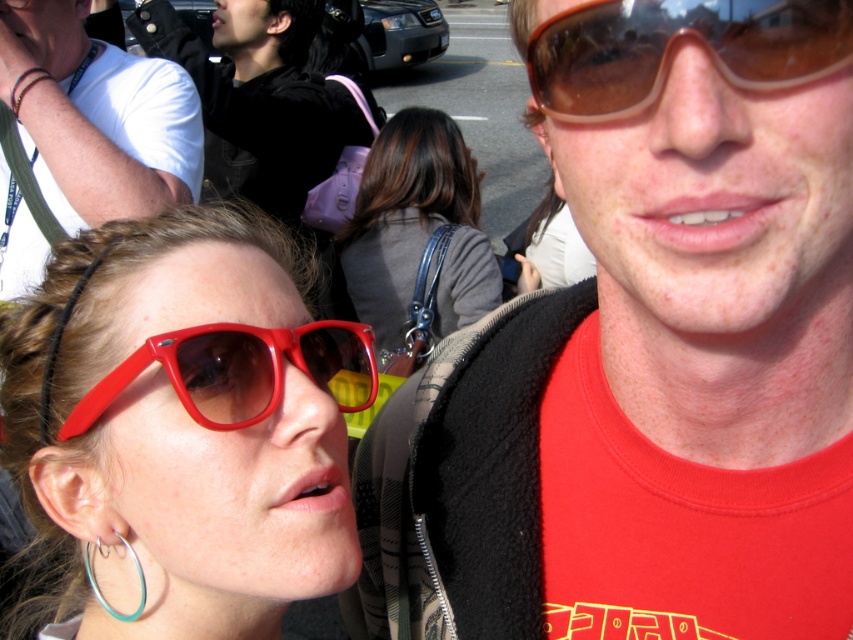
Question: Does matte red sunglasses at center-left have a smaller size compared to teal metallic hoop at lower left?

Choices:
 (A) yes
 (B) no

Answer: (B)

Question: Is matte red sunglasses at center to the left of teal metallic hoop at lower left from the viewer's perspective?

Choices:
 (A) yes
 (B) no

Answer: (B)

Question: Which object is the closest to the white fabric shirt at upper left?

Choices:
 (A) black fabric jacket at upper left
 (B) brown translucent goggles at upper right

Answer: (A)

Question: Does leather handbag at center appear on the right side of brown translucent goggles at upper right?

Choices:
 (A) yes
 (B) no

Answer: (B)

Question: Which point is farther to the camera?

Choices:
 (A) matte red sunglasses at upper left
 (B) black fabric jacket at upper left
 (C) leather handbag at center
 (D) matte red sunglasses at center

Answer: (C)

Question: Which of the following is the closest to the observer?

Choices:
 (A) leather handbag at center
 (B) matte red sunglasses at center
 (C) white fabric shirt at upper left

Answer: (B)